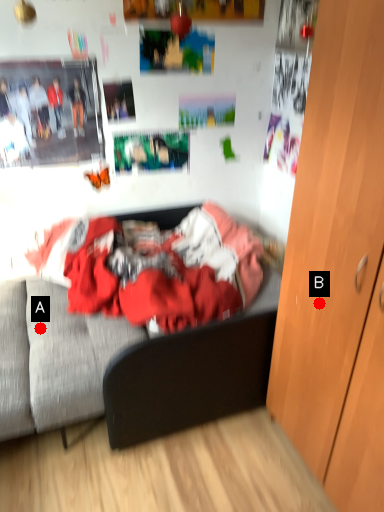
Question: Two points are circled on the image, labeled by A and B beside each circle. Which of the following is the farthest from the observer?

Choices:
 (A) A is further
 (B) B is further

Answer: (A)